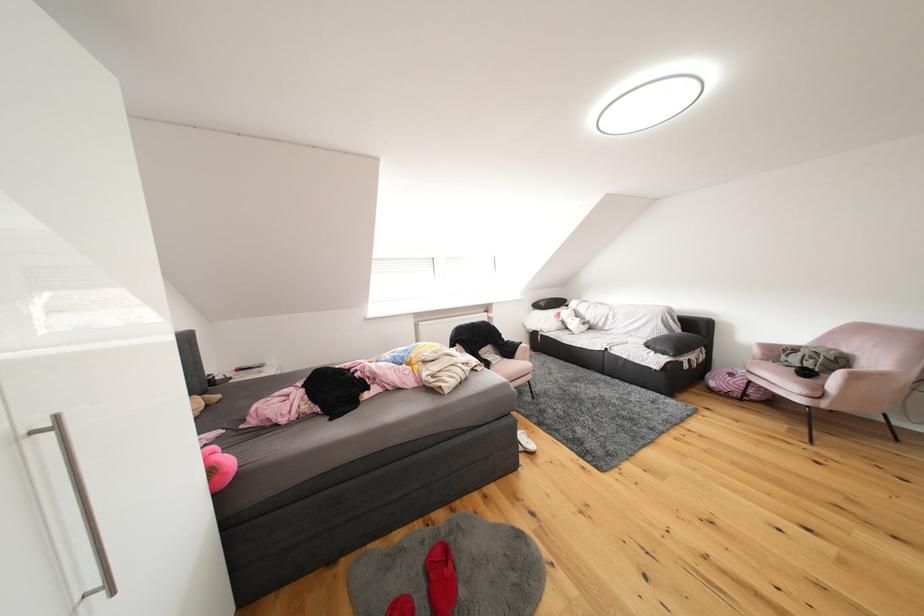
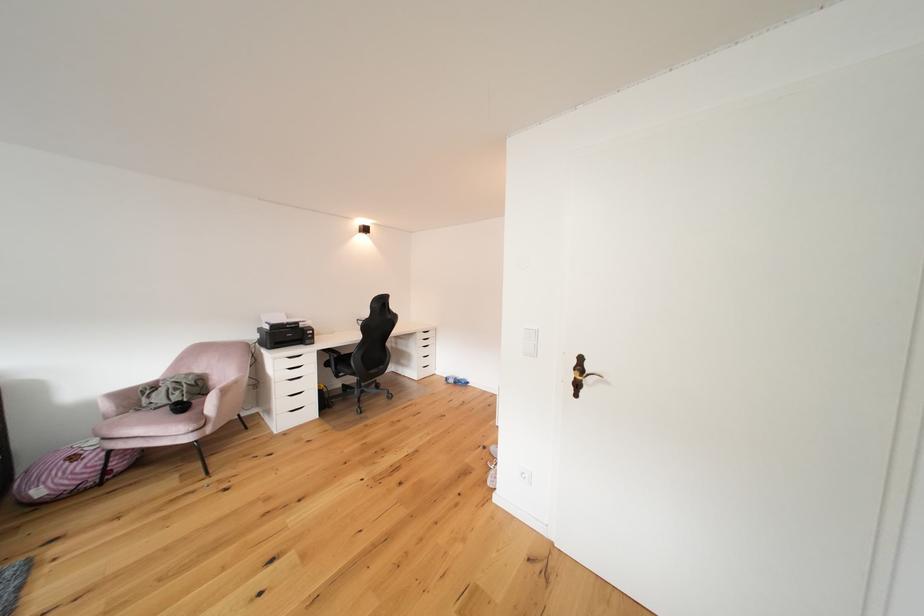
Where in the second image is the point corresponding to point (816, 378) from the first image?

(190, 411)